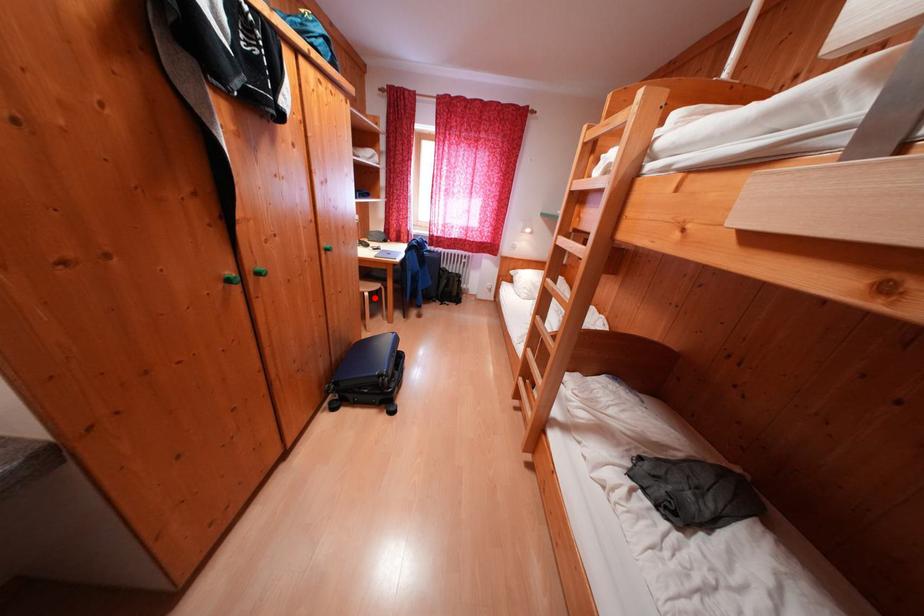
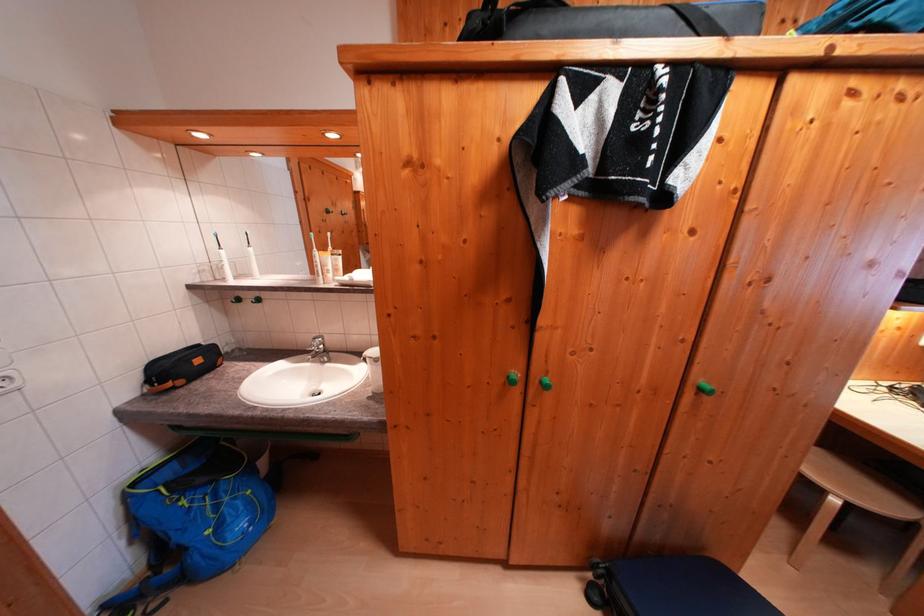
Question: I am providing you with two images of the same scene from different viewpoints. A red point is marked on the first image. At the location where the point appears in image 1, is it still visible in image 2?

Choices:
 (A) Yes
 (B) No

Answer: (A)